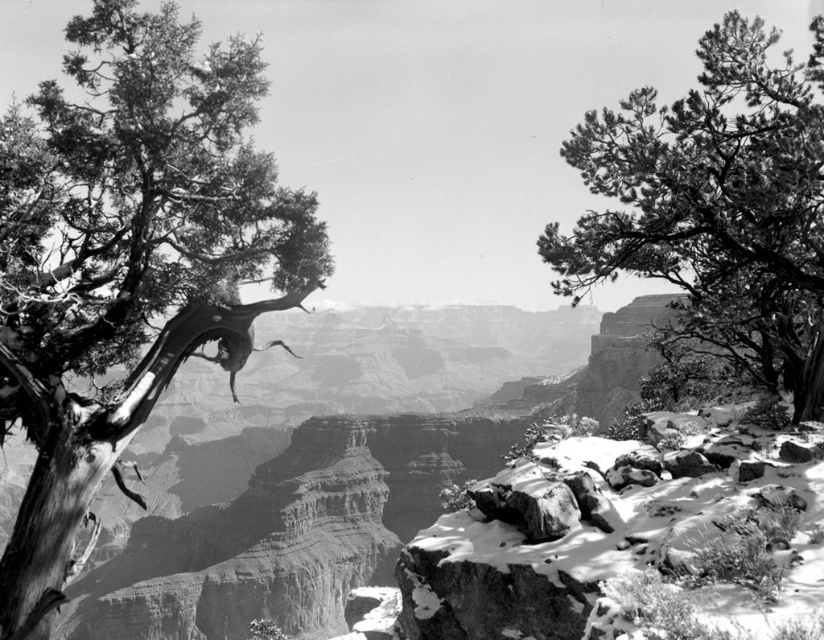
Who is positioned more to the left, dead wood tree at left or fine textured pine tree at upper right?

dead wood tree at left is more to the left.

Which is in front, point (54, 497) or point (715, 173)?

Point (54, 497)

Locate an element on the screen. This screenshot has width=824, height=640. dead wood tree at left is located at coordinates coord(129,260).